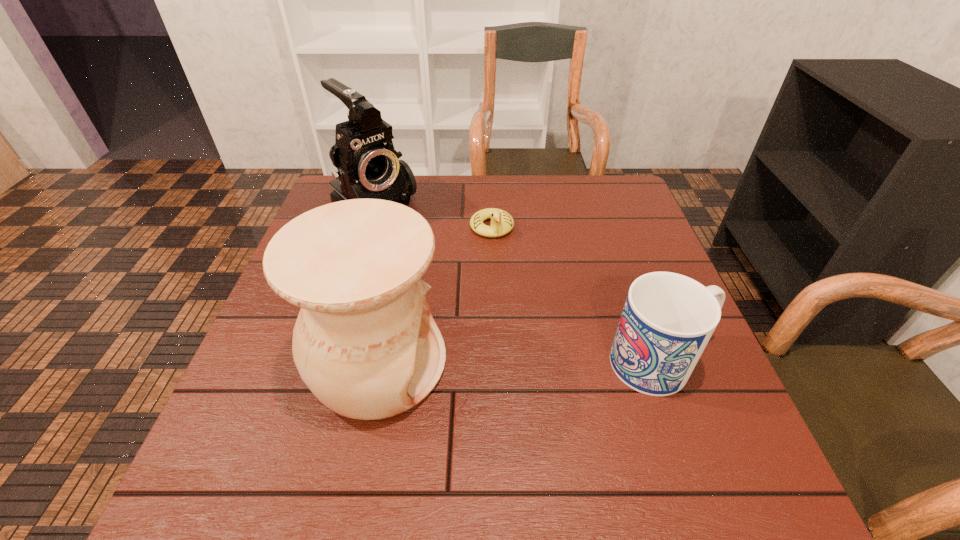
You are a GUI agent. You are given a task and a screenshot of the screen. Output one action in this format:
    pyautogui.click(x=<x>, y=<y>)
    Task: Click on the free space on the desktop that is between the pottery and the rightmost object and is positioned on the lens mount of the camcorder
    
    Given the screenshot: What is the action you would take?
    pyautogui.click(x=542, y=363)

Locate an element on the screen. This screenshot has height=540, width=960. free spot on the desktop that is between the pottery and the mug and is positioned on the face of the duckling is located at coordinates (536, 363).